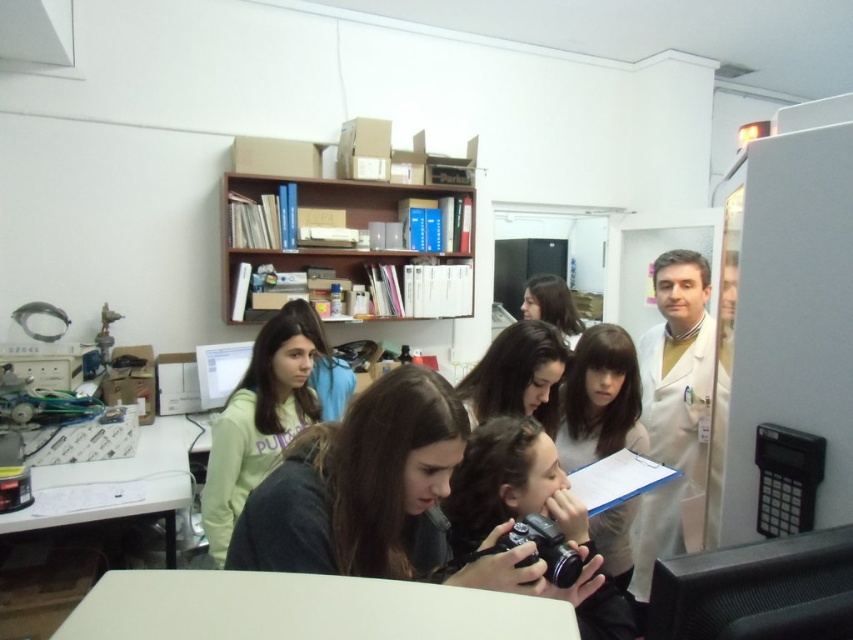
Between light green sweatshirt at center and smooth beige shirt at center, which one is positioned higher?

light green sweatshirt at center is above.

Who is positioned more to the left, light green sweatshirt at center or smooth beige shirt at center?

Positioned to the left is light green sweatshirt at center.

Is point (213, 429) more distant than point (579, 452)?

Yes, it is behind point (579, 452).

Identify the location of light green sweatshirt at center. (260, 419).

Is smooth beige shirt at center thinner than white glossy table at lower left?

Yes, smooth beige shirt at center is thinner than white glossy table at lower left.

Which of these two, smooth beige shirt at center or white glossy table at lower left, stands taller?

smooth beige shirt at center

Does point (602, 385) come in front of point (148, 468)?

Yes, point (602, 385) is closer to viewer.

Find the location of a particular element. This screenshot has height=640, width=853. smooth beige shirt at center is located at coordinates (601, 397).

Does point (296, 368) lie in front of point (141, 426)?

Yes, it is.

The width and height of the screenshot is (853, 640). What are the coordinates of `light green sweatshirt at center` in the screenshot? It's located at (260, 419).